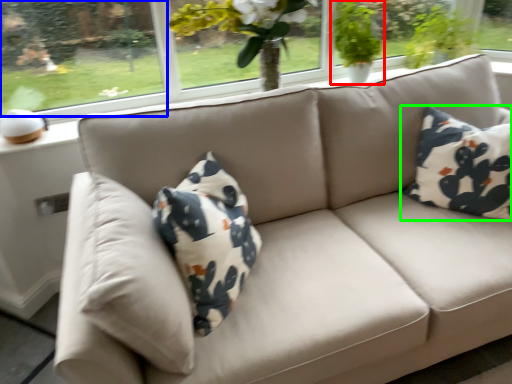
Question: Considering the real-world distances, which object is farthest from houseplant (highlighted by a red box)? window screen (highlighted by a blue box) or pillow (highlighted by a green box)?

Choices:
 (A) window screen
 (B) pillow

Answer: (A)